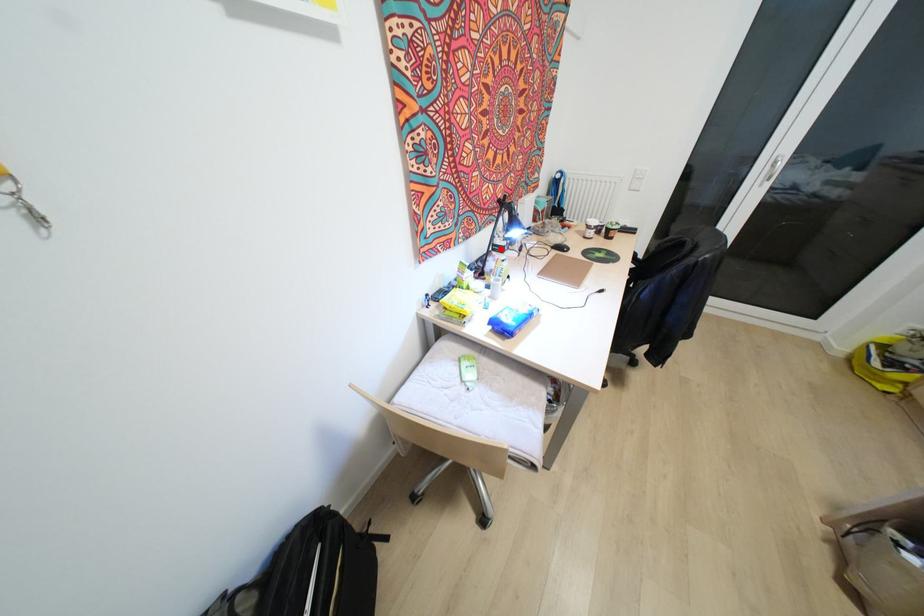
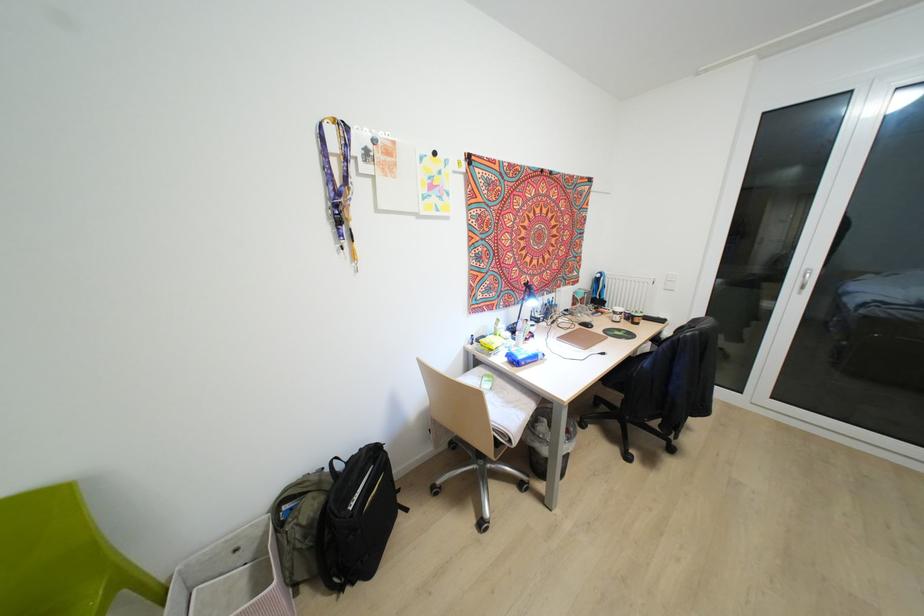
The point at the highlighted location is marked in the first image. Where is the corresponding point in the second image?

(536, 320)